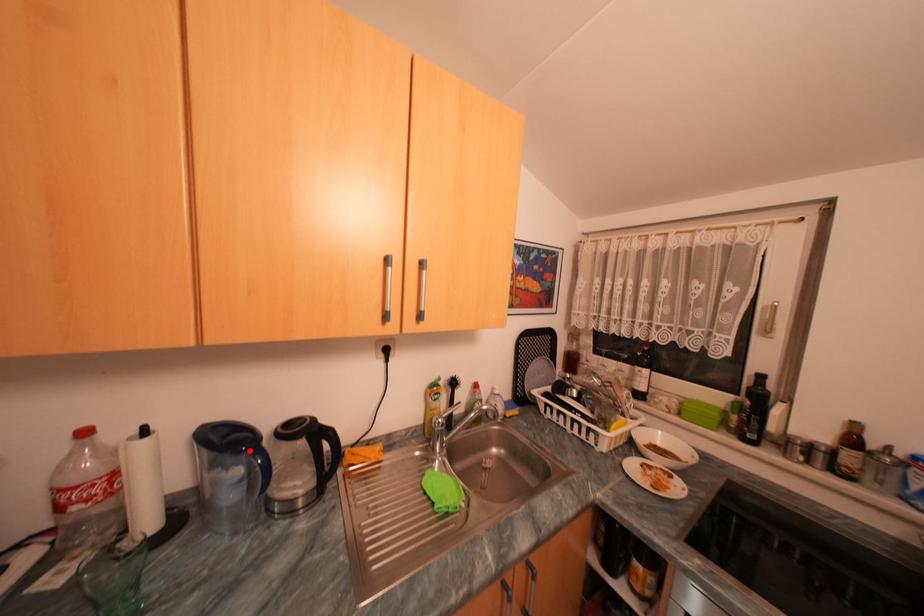
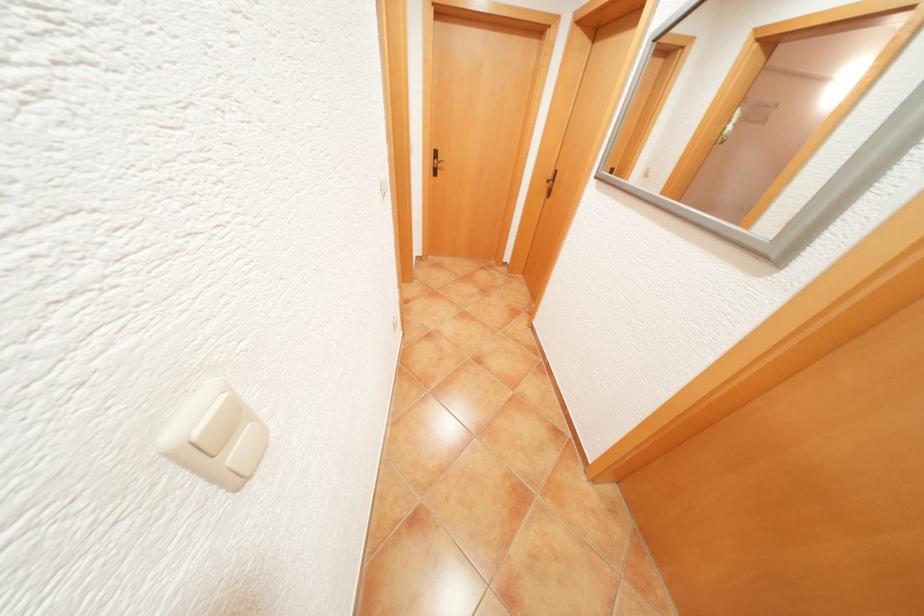
Question: I am providing you with two images of the same scene from different viewpoints. A red point is marked on the first image. At the location where the point appears in image 1, is it still visible in image 2?

Choices:
 (A) Yes
 (B) No

Answer: (B)